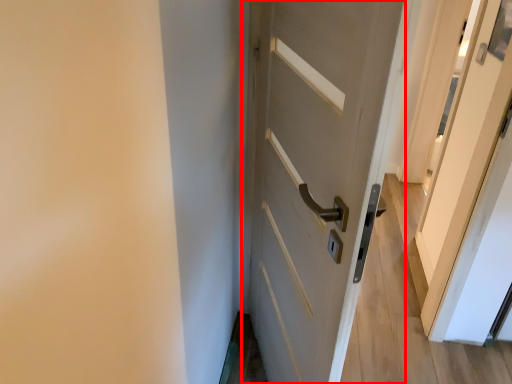
Question: From the image, what is the correct spatial relationship of door (annotated by the red box) in relation to screen door?

Choices:
 (A) right
 (B) left

Answer: (B)